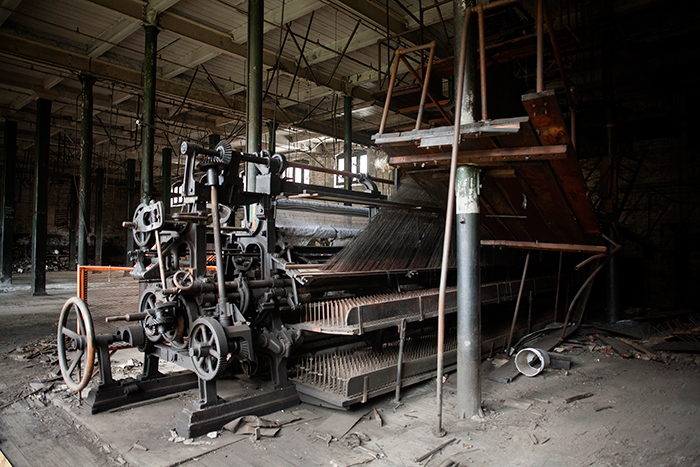
The width and height of the screenshot is (700, 467). I want to click on ceiling beam, so click(66, 96), click(106, 85), click(223, 47).